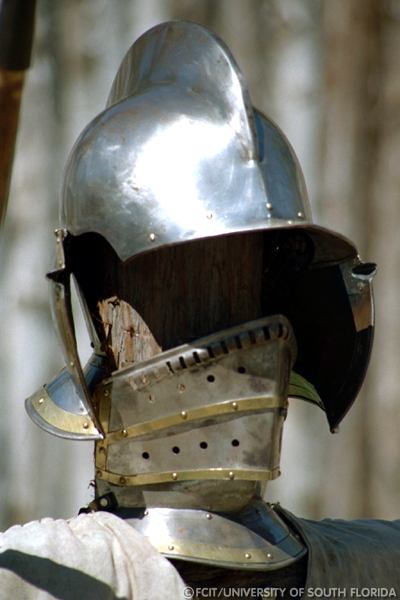
At what (x,y) coordinates should I click in order to perform the action: click on wood post. Please return your answer as a coordinate pair (x, y). Looking at the image, I should click on (223, 292).